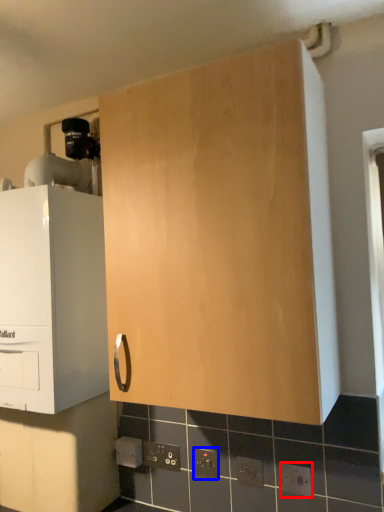
Question: Among these objects, which one is nearest to the camera, electric outlet (highlighted by a red box) or electric outlet (highlighted by a blue box)?

Choices:
 (A) electric outlet
 (B) electric outlet

Answer: (A)